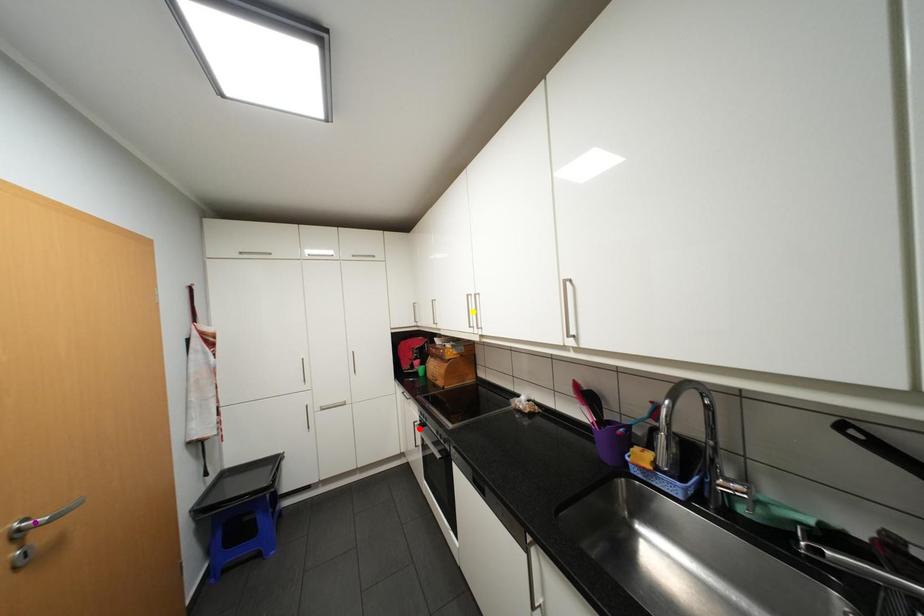
Looking at this image, order these from nearest to farthest:
- red point
- yellow point
- purple point

purple point
yellow point
red point